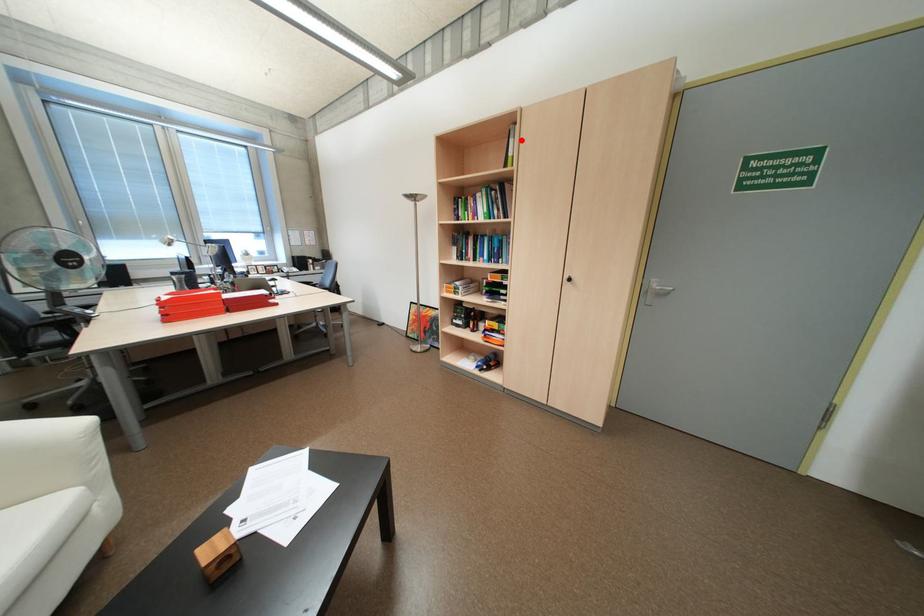
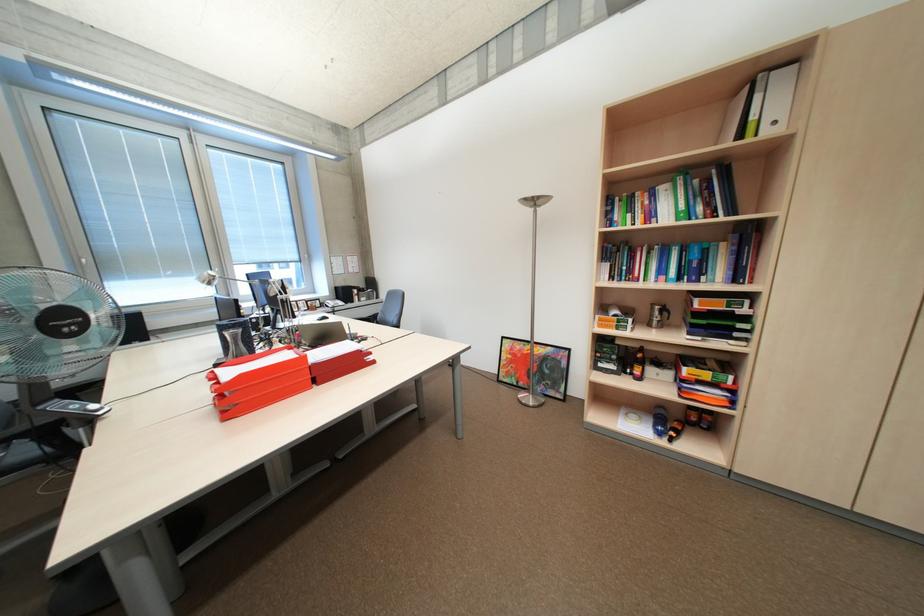
Question: I am providing you with two images of the same scene from different viewpoints. A red point is shown in image1. For the corresponding object point in image2, is it positioned nearer or farther from the camera?

Choices:
 (A) Nearer
 (B) Farther

Answer: (B)